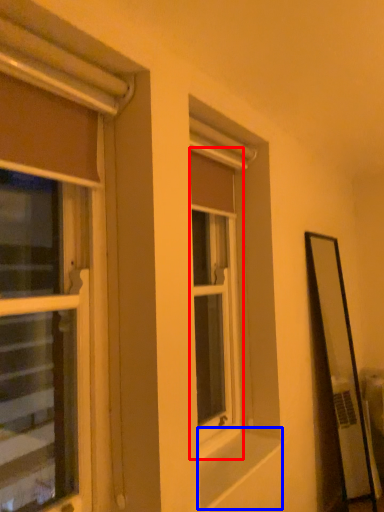
Question: Which object is closer to the camera taking this photo, window (highlighted by a red box) or window sill (highlighted by a blue box)?

Choices:
 (A) window
 (B) window sill

Answer: (B)